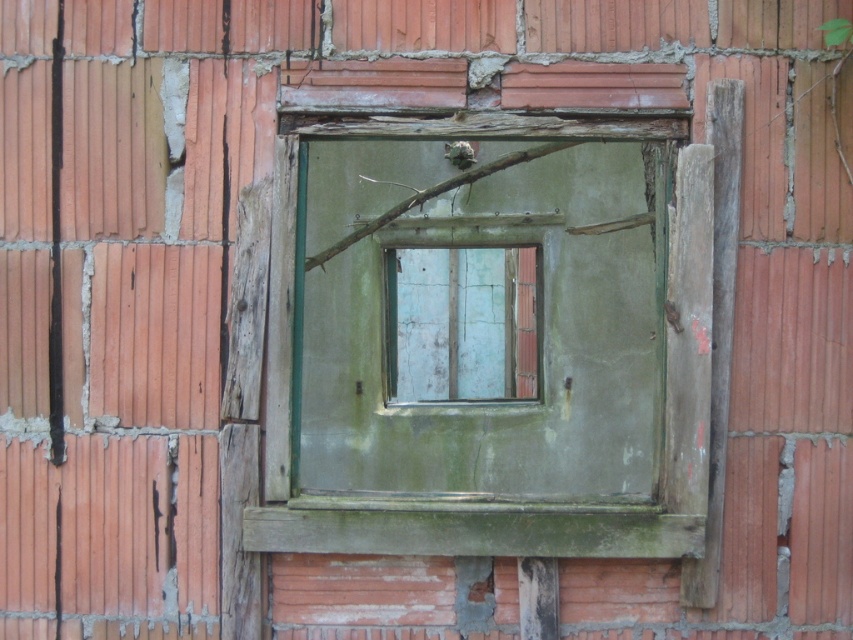
From the picture: You are standing in front of the weathered brick wall with the damaged window. There are two points marked on the wall at coordinates point (448, 172) and point (451, 355). Which of these points is closer to your viewpoint?

Point (448, 172) is closer to the camera than point (451, 355).

You are a contractor assessing the damage to the brick wall. You notice the green weathered wood at center and the peeling paint window at center. Which object is wider in width?

The green weathered wood at center might be wider than peeling paint window at center according to the description.

You are a contractor assessing the damage to a building exterior. You notice a point marked at coordinates (489, 349) on the wall. Based on the scene description, what material is located at this point?

The point at coordinates (489, 349) marks green weathered wood at center, which is part of the window frame described as having a greenish tint due to age and exposure.